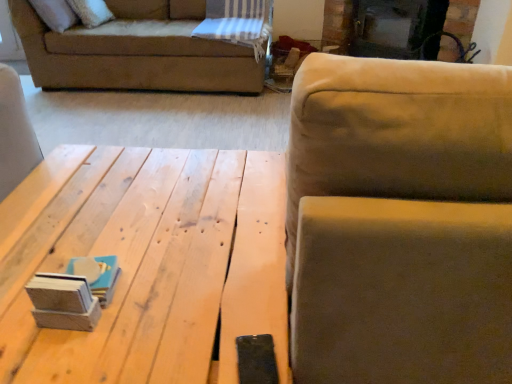
Question: Is black glass fireplace at upper center to the right of suede-like beige couch at upper right from the viewer's perspective?

Choices:
 (A) yes
 (B) no

Answer: (A)

Question: Does black glass fireplace at upper center have a smaller size compared to suede-like beige couch at upper right?

Choices:
 (A) no
 (B) yes

Answer: (B)

Question: Can you confirm if black glass fireplace at upper center is thinner than suede-like beige couch at upper right?

Choices:
 (A) no
 (B) yes

Answer: (B)

Question: Does black glass fireplace at upper center lie in front of suede-like beige couch at upper right?

Choices:
 (A) no
 (B) yes

Answer: (A)

Question: Considering the relative sizes of black glass fireplace at upper center and suede-like beige couch at upper right in the image provided, is black glass fireplace at upper center wider than suede-like beige couch at upper right?

Choices:
 (A) yes
 (B) no

Answer: (B)

Question: Considering the positions of suede-like beige couch at upper right and natural wood table at center in the image, is suede-like beige couch at upper right wider or thinner than natural wood table at center?

Choices:
 (A) thin
 (B) wide

Answer: (A)

Question: Is suede-like beige couch at upper right in front of or behind natural wood table at center in the image?

Choices:
 (A) behind
 (B) front

Answer: (B)

Question: In terms of height, does suede-like beige couch at upper right look taller or shorter compared to natural wood table at center?

Choices:
 (A) tall
 (B) short

Answer: (A)

Question: Choose the correct answer: Is suede-like beige couch at upper right inside natural wood table at center or outside it?

Choices:
 (A) inside
 (B) outside

Answer: (B)

Question: In terms of size, does black glass fireplace at upper center appear bigger or smaller than natural wood table at center?

Choices:
 (A) small
 (B) big

Answer: (A)

Question: From the image's perspective, is black glass fireplace at upper center positioned above or below natural wood table at center?

Choices:
 (A) above
 (B) below

Answer: (A)

Question: Looking at their shapes, would you say black glass fireplace at upper center is wider or thinner than natural wood table at center?

Choices:
 (A) thin
 (B) wide

Answer: (A)

Question: From their relative heights in the image, would you say black glass fireplace at upper center is taller or shorter than natural wood table at center?

Choices:
 (A) short
 (B) tall

Answer: (B)

Question: Is natural wood table at center in front of or behind suede-like beige couch at upper right in the image?

Choices:
 (A) behind
 (B) front

Answer: (A)

Question: From a real-world perspective, is natural wood table at center above or below suede-like beige couch at upper right?

Choices:
 (A) below
 (B) above

Answer: (A)